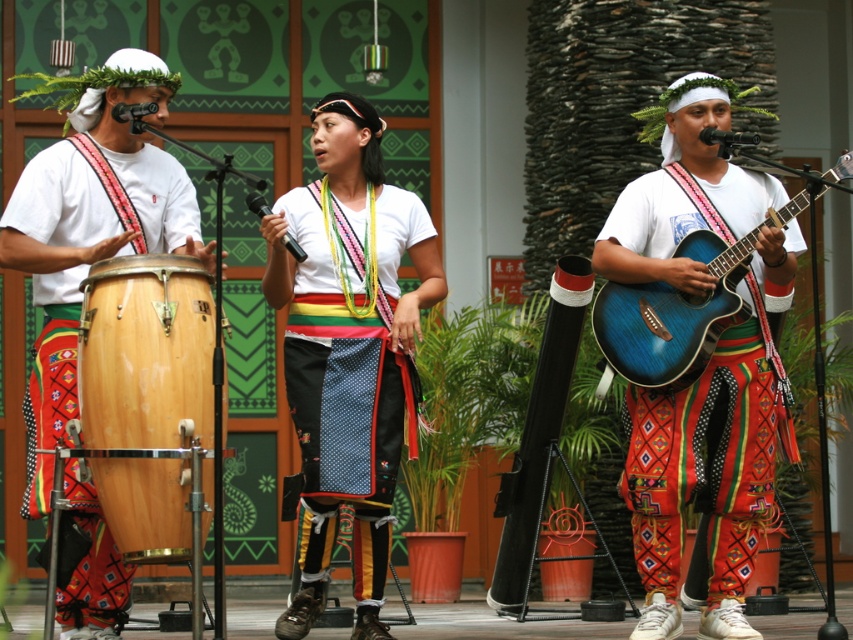
Question: In this image, where is matte blue guitar at center located relative to blue wood guitar at right?

Choices:
 (A) right
 (B) left

Answer: (A)

Question: Based on their relative distances, which object is nearer to the blue wood guitar at right?

Choices:
 (A) matte blue guitar at center
 (B) natural wood drum at left

Answer: (A)

Question: Does matte blue guitar at center appear on the left side of natural wood drum at left?

Choices:
 (A) yes
 (B) no

Answer: (B)

Question: Which of the following is the closest to the observer?

Choices:
 (A) (656, 381)
 (B) (157, 429)
 (C) (386, 260)

Answer: (B)

Question: Based on their relative distances, which object is nearer to the natural wood drum at left?

Choices:
 (A) white cotton shirt at center
 (B) matte blue guitar at center
 (C) blue wood guitar at right

Answer: (A)

Question: Considering the relative positions of matte blue guitar at center and white cotton shirt at center in the image provided, where is matte blue guitar at center located with respect to white cotton shirt at center?

Choices:
 (A) above
 (B) below

Answer: (A)